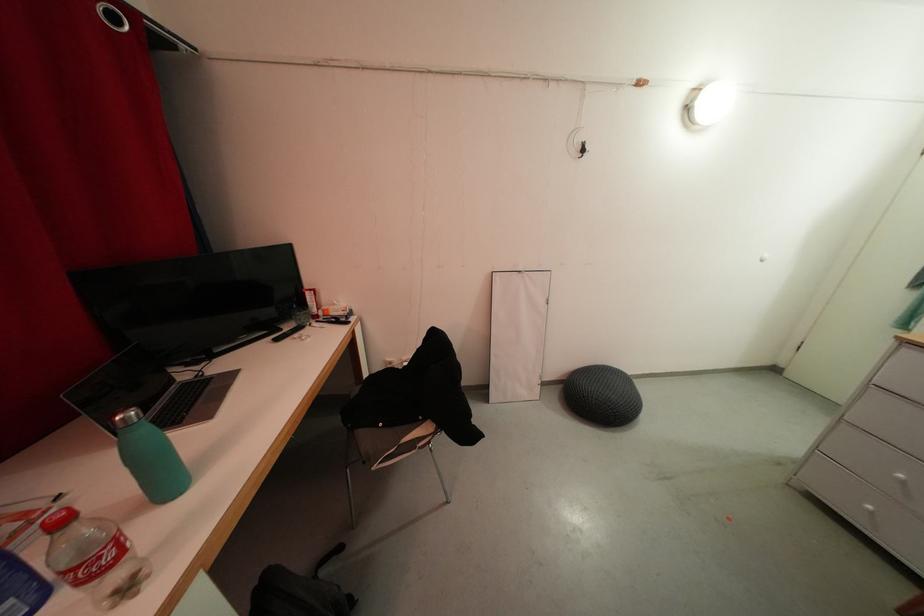
Where would you lift the black backpack? Please return your answer as a coordinate pair (x, y).

(299, 592)